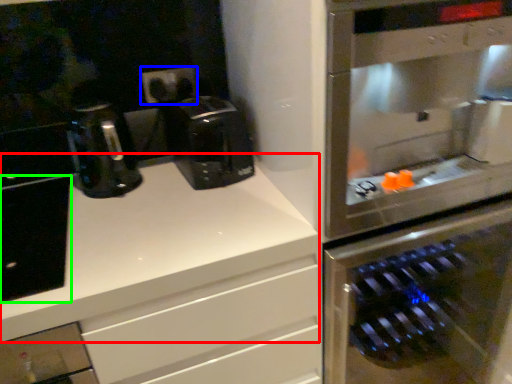
Question: Considering the real-world distances, which object is closest to counter top (highlighted by a red box)? electric outlet (highlighted by a blue box) or cabinetry (highlighted by a green box).

Choices:
 (A) electric outlet
 (B) cabinetry

Answer: (B)